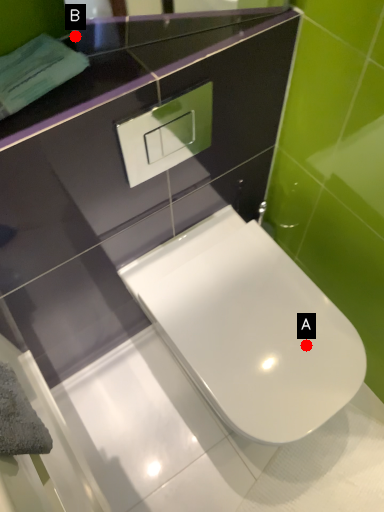
Question: Two points are circled on the image, labeled by A and B beside each circle. Which of the following is the farthest from the observer?

Choices:
 (A) A is further
 (B) B is further

Answer: (A)